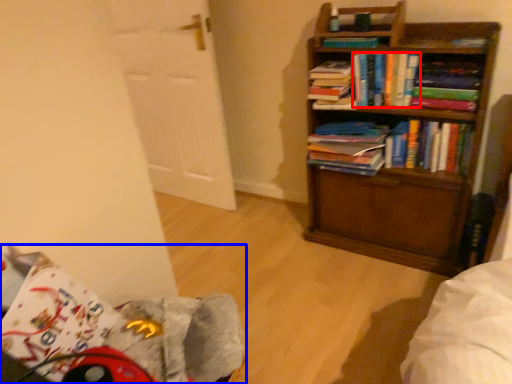
Question: Which object is further to the camera taking this photo, book (highlighted by a red box) or swivel chair (highlighted by a blue box)?

Choices:
 (A) book
 (B) swivel chair

Answer: (A)